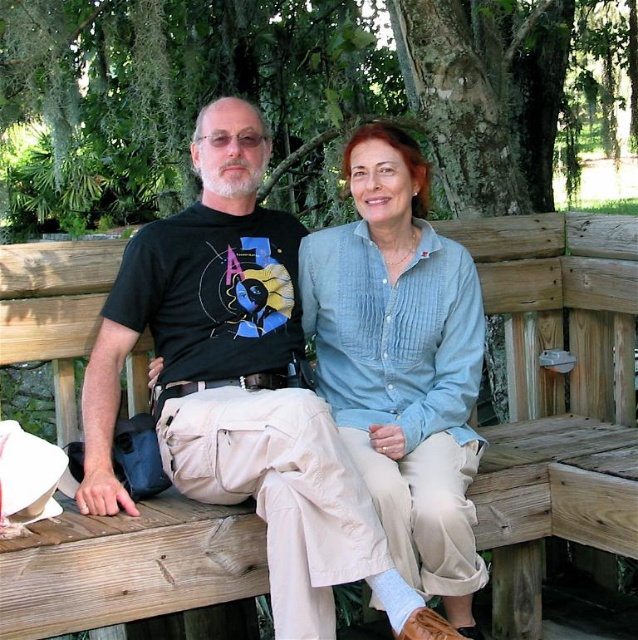
You are planning to take a photo of the wooden bench at center and the green mossy tree at upper center. Which object should you focus on first if you want to capture both in the frame without moving the camera?

The green mossy tree at upper center is to the left of the wooden bench at center, so you should focus on the green mossy tree at upper center first to ensure both are in the frame.

You are a park ranger trying to locate the green mossy tree at upper center in the image. According to the coordinates provided, where would you find it?

The green mossy tree at upper center is located at coordinates point (300,97).